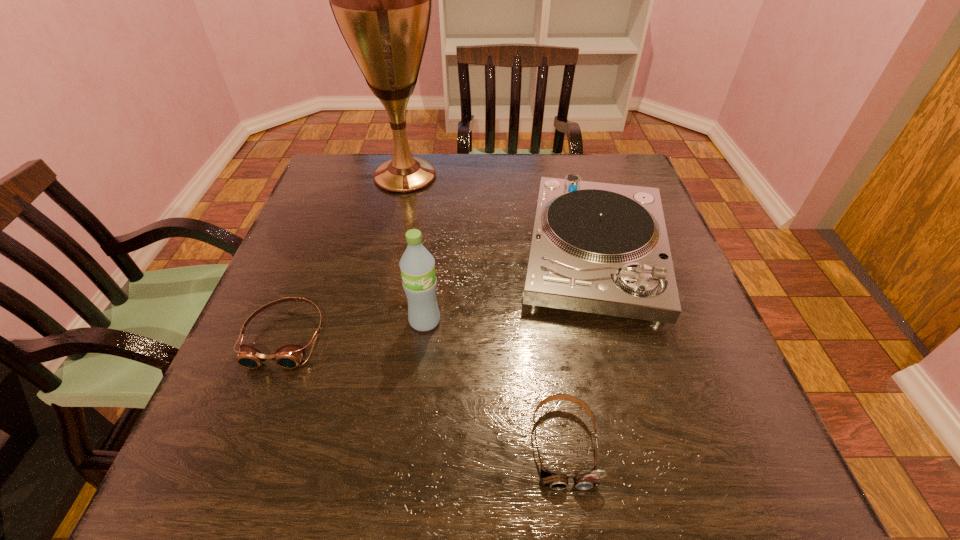
Image resolution: width=960 pixels, height=540 pixels. Identify the location of trophy cup that is positioned at the far edge. (381, 0).

What are the coordinates of `record player located at the far edge` in the screenshot? It's located at (602, 248).

At what (x,y) coordinates should I click in order to perform the action: click on object that is positioned at the near edge. Please return your answer as a coordinate pair (x, y). This screenshot has width=960, height=540. Looking at the image, I should click on (555, 481).

Where is `trophy cup that is at the left edge`? trophy cup that is at the left edge is located at coordinates (381, 0).

The image size is (960, 540). I want to click on goggles that is positioned at the left edge, so click(x=289, y=356).

The image size is (960, 540). Find the location of `object that is at the right edge`. object that is at the right edge is located at coordinates (602, 248).

You are a GUI agent. You are given a task and a screenshot of the screen. Output one action in this format:
    pyautogui.click(x=<x>, y=<y>)
    Task: Click on the object located in the far left corner section of the desktop
    
    Given the screenshot: What is the action you would take?
    pyautogui.click(x=381, y=0)

This screenshot has width=960, height=540. Find the location of `object located at the far right corner`. object located at the far right corner is located at coordinates (602, 248).

Where is `free point at the far edge`? free point at the far edge is located at coordinates (444, 165).

Identify the location of vacant space at the near edge of the desktop. Image resolution: width=960 pixels, height=540 pixels. (320, 464).